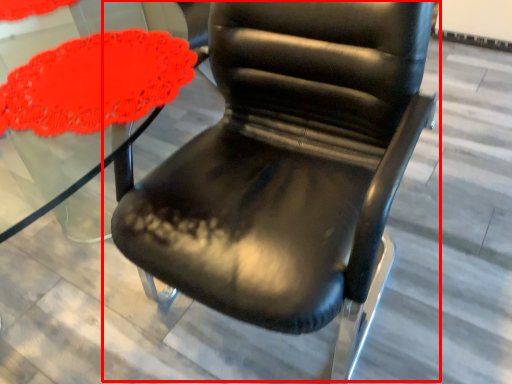
Question: Where is chair (annotated by the red box) located in relation to round table in the image?

Choices:
 (A) right
 (B) left

Answer: (A)